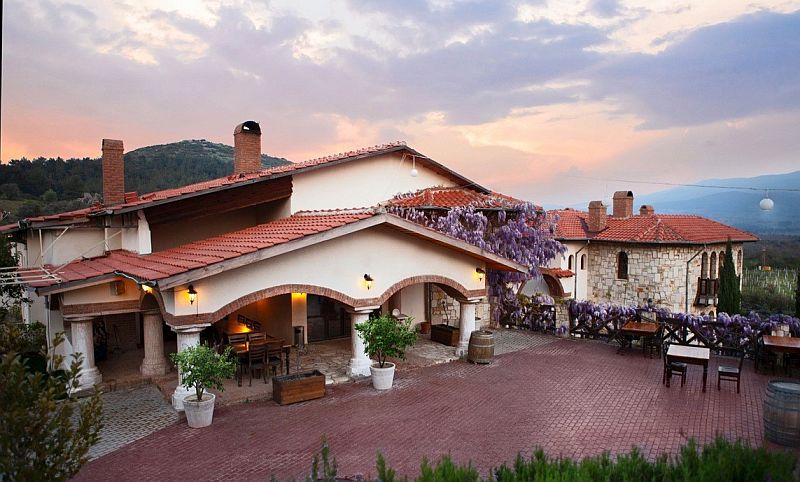
Where is `white tabletop`? This screenshot has width=800, height=482. white tabletop is located at coordinates (692, 352).